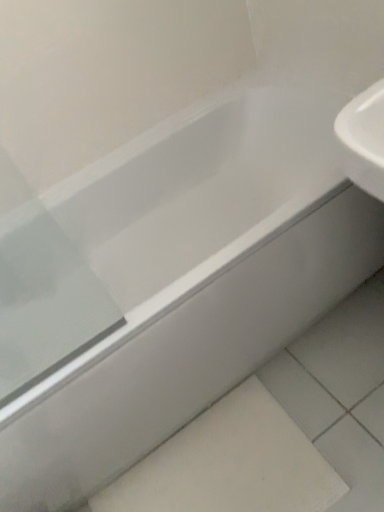
Identify the location of free spot below white matte ceramic tile at lower center (from a real-world perspective). This screenshot has height=512, width=384. (223, 473).